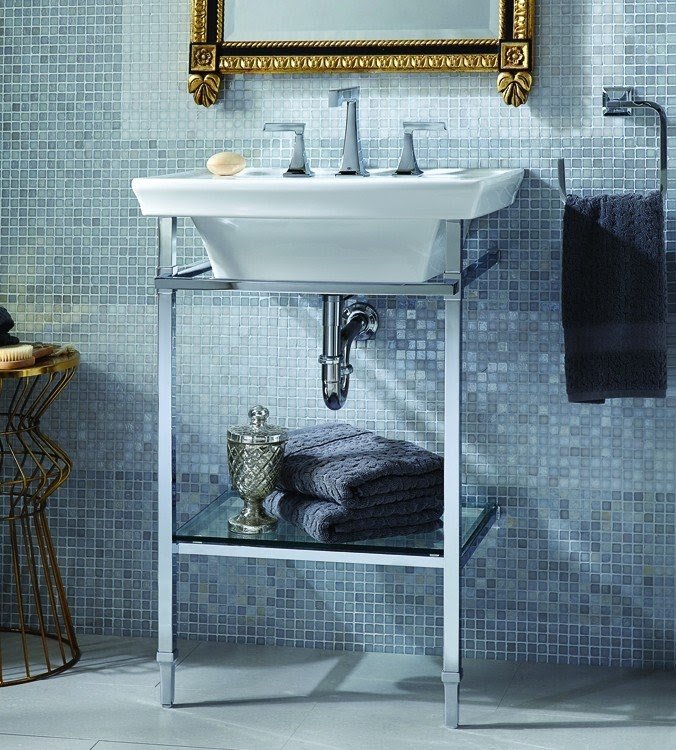
In order to click on wall in this screenshot , I will do `click(507, 447)`.